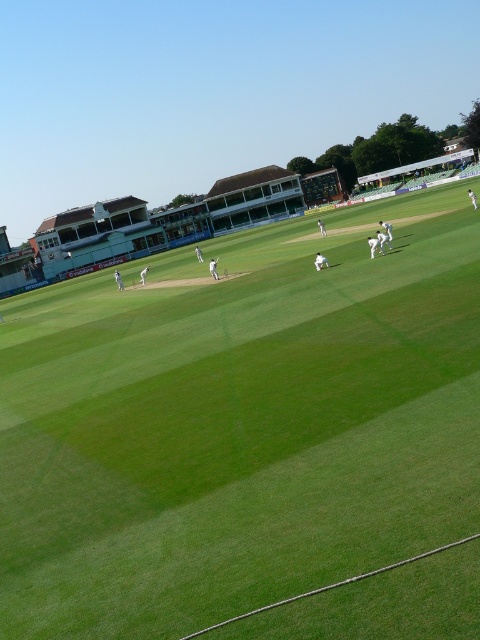
Between green grass cricket field at center and white cloth cricket bat at center, which one has less height?

With less height is white cloth cricket bat at center.

Which is more to the left, green grass cricket field at center or white cloth cricket bat at center?

green grass cricket field at center

Is point (84, 474) in front of point (317, 259)?

Yes, point (84, 474) is closer to viewer.

Identify the location of green grass cricket field at center. The image size is (480, 640). (239, 420).